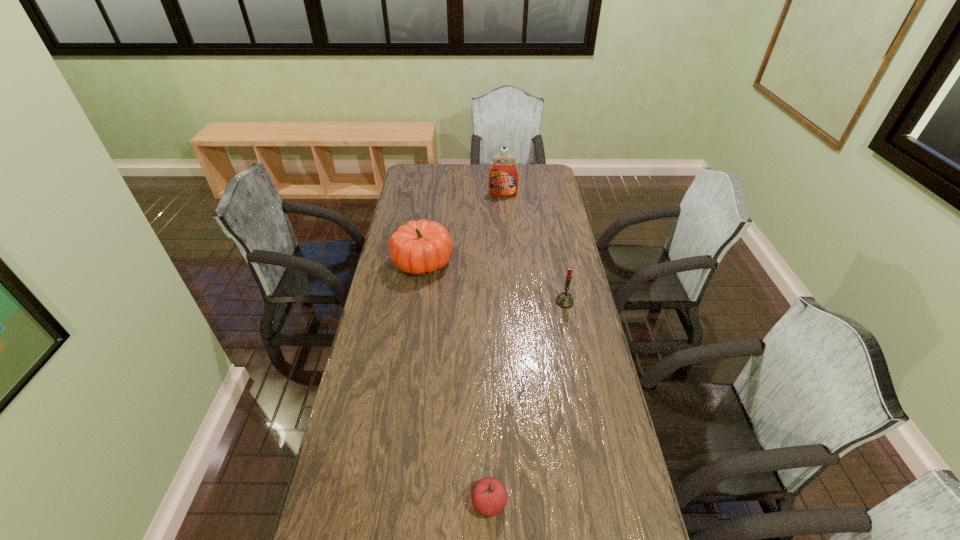
The width and height of the screenshot is (960, 540). I want to click on the farthest object, so click(503, 179).

Locate an element on the screen. detergent is located at coordinates (503, 179).

Image resolution: width=960 pixels, height=540 pixels. Find the location of `pumpkin`. pumpkin is located at coordinates (421, 246).

The width and height of the screenshot is (960, 540). Identify the location of the leftmost object. (421, 246).

Where is `candle`? This screenshot has height=540, width=960. candle is located at coordinates (564, 300).

You are a GUI agent. You are given a task and a screenshot of the screen. Output one action in this format:
    pyautogui.click(x=<x>, y=<y>)
    Task: Click on the rightmost object
    
    Given the screenshot: What is the action you would take?
    pyautogui.click(x=564, y=300)

Find the location of a particular element. Image resolution: width=960 pixels, height=540 pixels. tomato is located at coordinates (489, 497).

Find the location of a particular element. The height and width of the screenshot is (540, 960). the nearest object is located at coordinates (489, 497).

The width and height of the screenshot is (960, 540). In order to click on vacant space located on the front surface of the farthest object in this screenshot , I will do `click(504, 206)`.

Identify the location of vacant space situated on the front of the leftmost object. tap(406, 367).